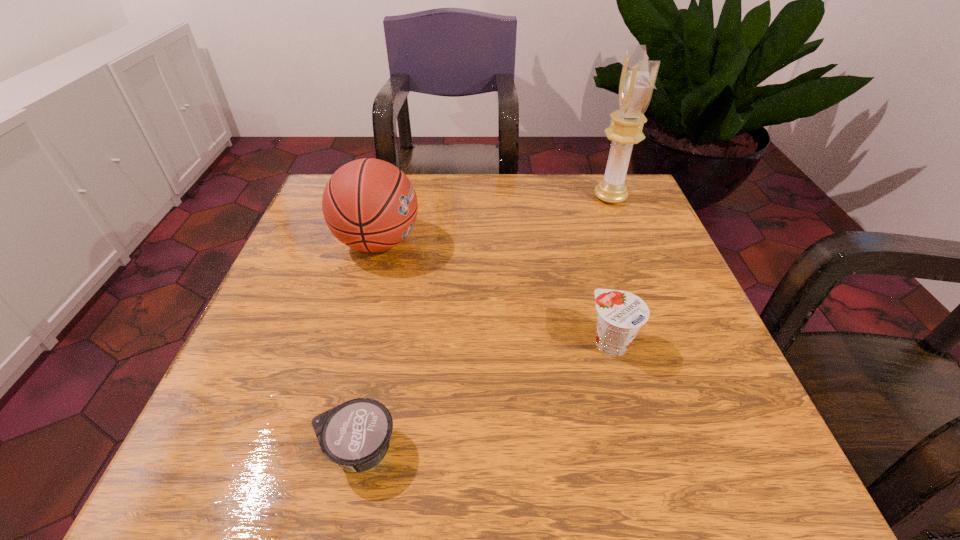
Identify the location of free point between the nearest object and the tallest object. Image resolution: width=960 pixels, height=540 pixels. (484, 323).

Locate an element on the screen. vacant space that's between the left yogurt and the farther yogurt is located at coordinates (485, 396).

Find the location of a particular element. The height and width of the screenshot is (540, 960). empty location between the shorter yogurt and the second farthest object is located at coordinates (369, 346).

Locate an element on the screen. The width and height of the screenshot is (960, 540). vacant space in between the shorter yogurt and the basketball is located at coordinates coord(369,346).

I want to click on free spot between the second nearest object and the shorter yogurt, so click(x=485, y=396).

Find the location of `vacant space in between the second object from right to left and the third nearest object`. vacant space in between the second object from right to left and the third nearest object is located at coordinates (494, 293).

Locate an element on the screen. empty location between the rightmost object and the right yogurt is located at coordinates (611, 270).

You are a GUI agent. You are given a task and a screenshot of the screen. Output one action in this format:
    pyautogui.click(x=<x>, y=<y>)
    Task: Click on the free space that is in between the second farthest object and the farthest object
    This screenshot has height=540, width=960.
    Given the screenshot: What is the action you would take?
    pyautogui.click(x=494, y=220)

Identify which object is located as the third nearest to the nearest object. Please provide its 2D coordinates. Your answer should be formatted as a tuple, i.e. [(x, y)], where the tuple contains the x and y coordinates of a point satisfying the conditions above.

[(638, 76)]

Choose which object is the nearest neighbor to the second farthest object. Please provide its 2D coordinates. Your answer should be formatted as a tuple, i.e. [(x, y)], where the tuple contains the x and y coordinates of a point satisfying the conditions above.

[(356, 434)]